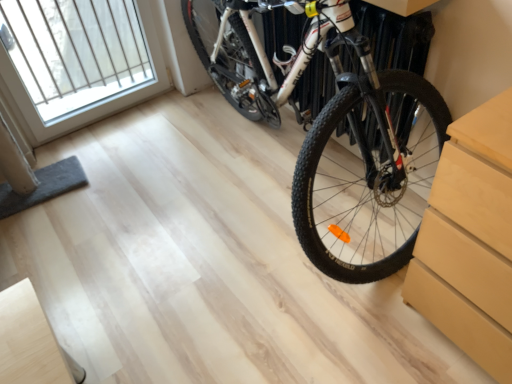
Identify the location of free spot to the right of white glass window at upper left. (179, 124).